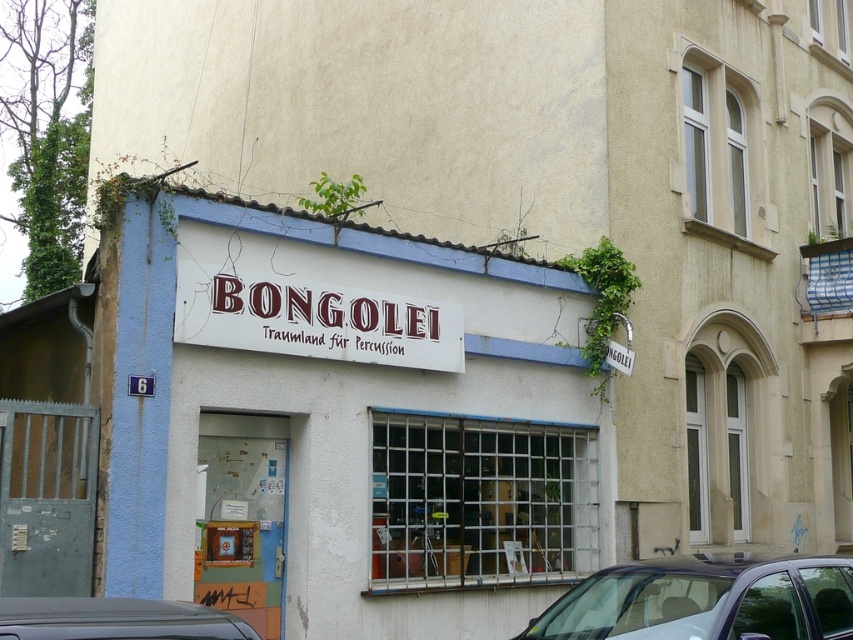
You are a delivery person trying to park your metallic gray car at lower left near the storefront. The matte red sign at center is in your way. Can you park there without hitting the sign?

The matte red sign at center might be wider than metallic gray car at lower left, so there is a possibility that the car could hit the sign if parked too close. It is safer to avoid parking directly under the sign to prevent any potential damage.

You are standing in front of the BONGOLEI Traumland percussion shop. There are two points marked on the building. One is at coordinate point (254, 620) and the other at point (183, 296). Which point is closer to you?

Point (183, 296) is closer to you because it is less further than point (254, 620).